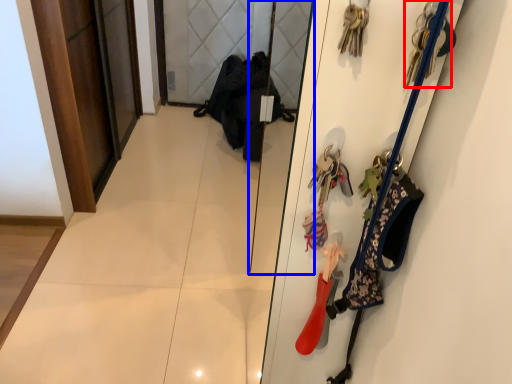
Question: Which of the following is the closest to the observer, accessory (highlighted by a red box) or mirror (highlighted by a blue box)?

Choices:
 (A) accessory
 (B) mirror

Answer: (A)